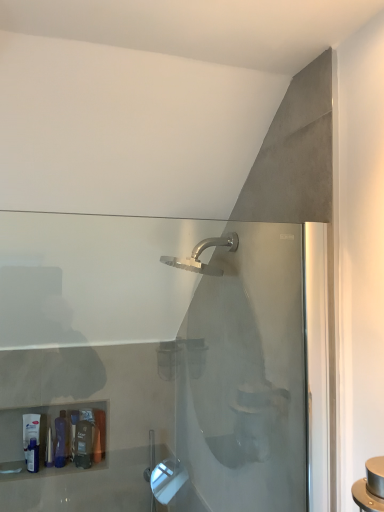
Question: Is point (89, 446) closer or farther from the camera than point (29, 428)?

Choices:
 (A) farther
 (B) closer

Answer: (A)

Question: Based on their sizes in the image, would you say translucent plastic bottle at lower left, the third toiletry viewed from the left, is bigger or smaller than matte white tube at lower left, the 3th toiletry in the right-to-left sequence?

Choices:
 (A) small
 (B) big

Answer: (A)

Question: Which object is positioned farthest from the translucent plastic tube at lower left, which appears as the 2th toiletry when viewed from the right?

Choices:
 (A) translucent plastic bottle at lower left, placed as the 1th toiletry when sorted from right to left
 (B) matte white tube at lower left, the 3th toiletry in the right-to-left sequence

Answer: (B)

Question: Considering the real-world distances, which object is closest to the translucent plastic tube at lower left, which is the second toiletry from left to right?

Choices:
 (A) translucent plastic bottle at lower left, placed as the 1th toiletry when sorted from right to left
 (B) matte white tube at lower left, arranged as the first toiletry when viewed from the left

Answer: (A)